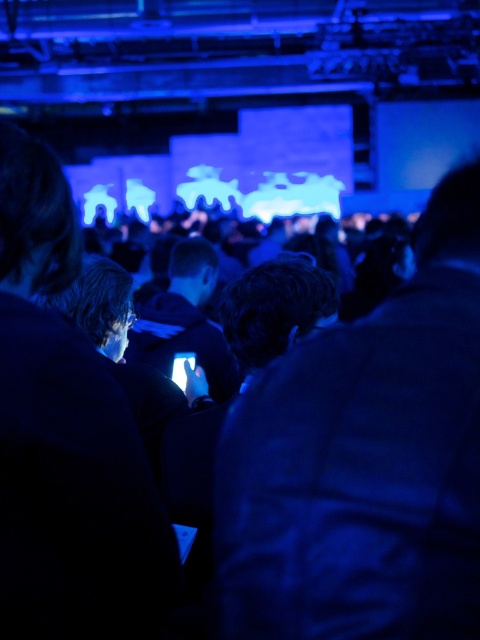
Question: Which of the following is the closest to the observer?

Choices:
 (A) matte black laptop at left
 (B) dark blue leather jacket at center

Answer: (B)

Question: Is dark blue leather jacket at center bigger than matte black laptop at left?

Choices:
 (A) no
 (B) yes

Answer: (B)

Question: Is the position of dark blue leather jacket at center less distant than that of matte black laptop at left?

Choices:
 (A) no
 (B) yes

Answer: (B)

Question: Can you confirm if dark blue leather jacket at center is wider than matte black laptop at left?

Choices:
 (A) no
 (B) yes

Answer: (B)

Question: Among these points, which one is nearest to the camera?

Choices:
 (A) (220, 579)
 (B) (49, 604)

Answer: (B)